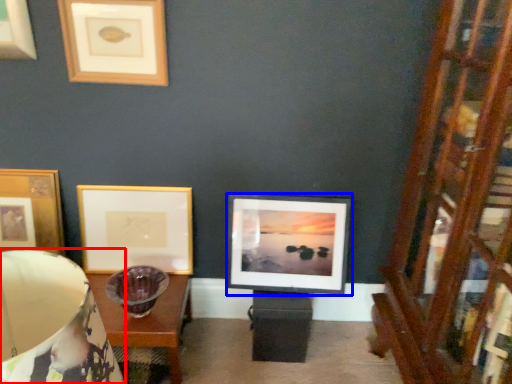
Question: Which object is further to the camera taking this photo, table lamp (highlighted by a red box) or picture frame (highlighted by a blue box)?

Choices:
 (A) table lamp
 (B) picture frame

Answer: (B)